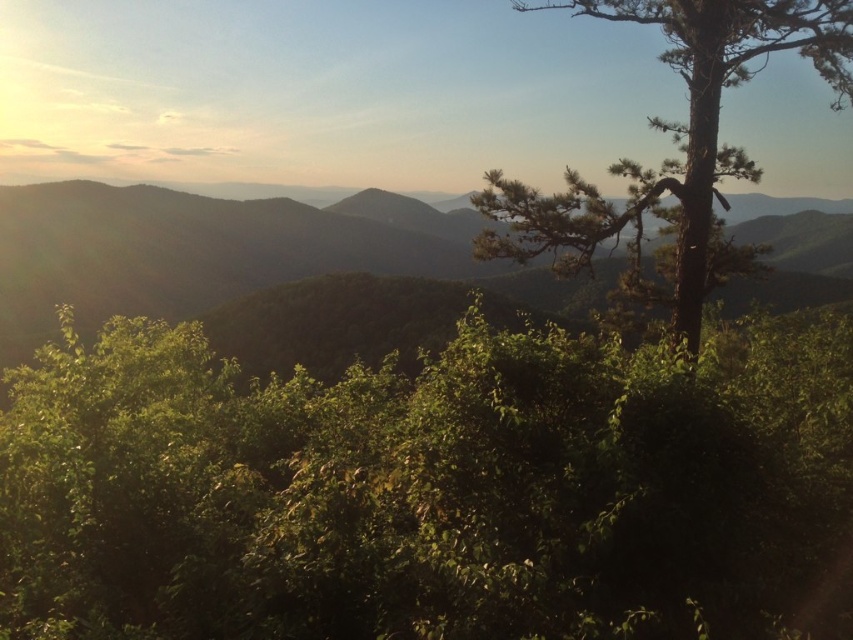
Question: In this image, where is green leafy tree at center located relative to green matte hill at center?

Choices:
 (A) below
 (B) above

Answer: (A)

Question: Which point appears closest to the camera in this image?

Choices:
 (A) (344, 250)
 (B) (844, 17)

Answer: (B)

Question: Can you confirm if green leafy vegetation at center is positioned to the right of green matte hill at center?

Choices:
 (A) yes
 (B) no

Answer: (A)

Question: Which is nearer to the green leafy tree at center?

Choices:
 (A) green matte hill at center
 (B) green textured tree at right

Answer: (B)

Question: Is green leafy tree at center smaller than green leafy vegetation at center?

Choices:
 (A) yes
 (B) no

Answer: (A)

Question: Which point is farther to the camera?

Choices:
 (A) green leafy vegetation at center
 (B) green matte hill at center

Answer: (B)